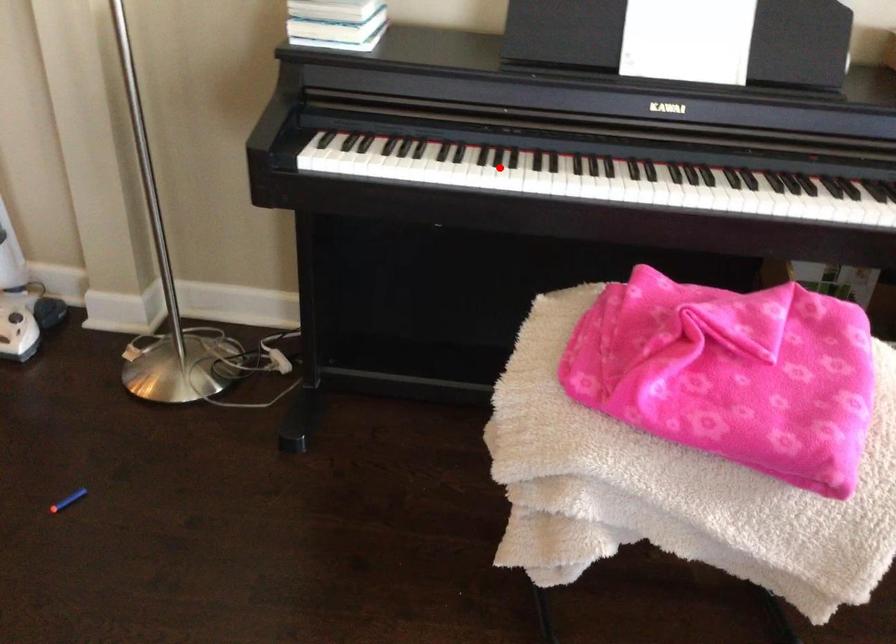
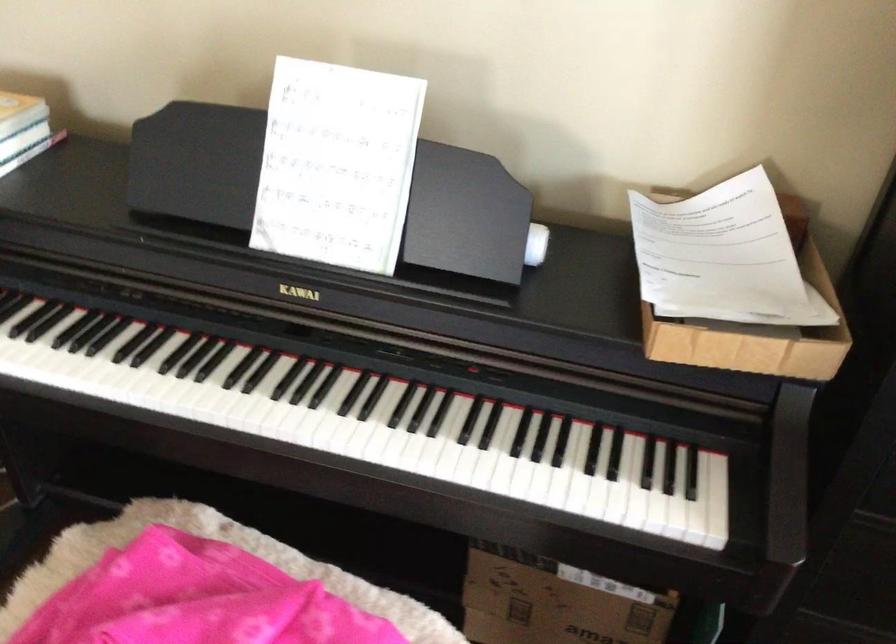
In the second image, find the point that corresponds to the highlighted location in the first image.

(58, 368)